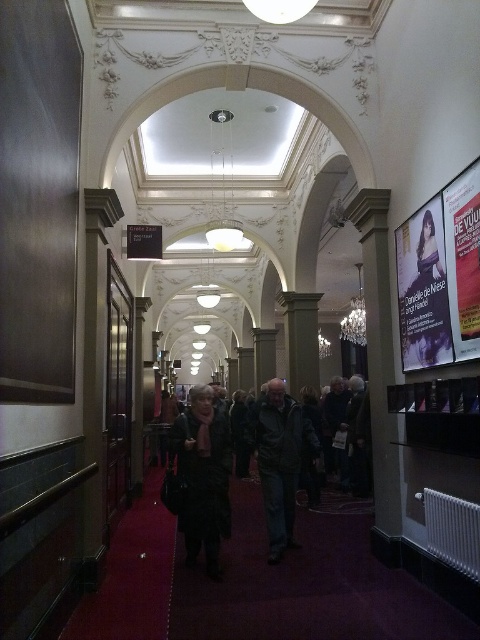
You are a theater usher who needs to guide a guest to the entrance of the dark wooden door with glass panels on the left. The guest is currently standing near the dark gray wool coat at center and the matte paper poster at right. Which object should they move towards to reach the door more quickly?

The dark gray wool coat at center is to the left of matte paper poster at right. Since the door is on the left side of the hallway, the guest should move towards the dark gray wool coat at center to reach the door more quickly.

You are an usher in this theater hallway. You need to walk from the entrance to the dark gray coat at center and the dark gray wool coat at center. Can you comfortably walk between them without stepping on either coat?

The dark gray coat at center and the dark gray wool coat at center are 27.16 centimeters apart. Since the distance between them is only about 27 cm, it would be difficult to comfortably walk between them without stepping on either coat, as this space is too narrow for safe passage.